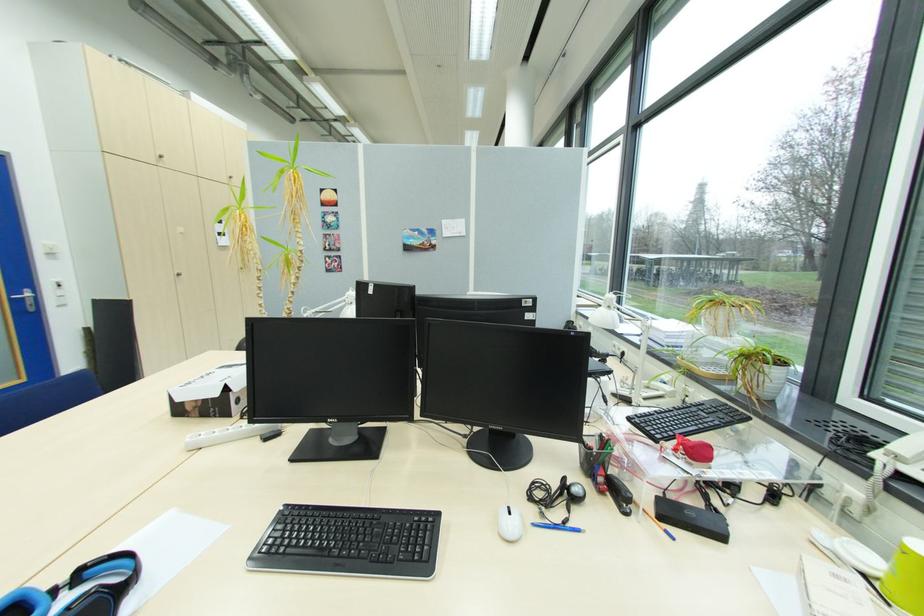
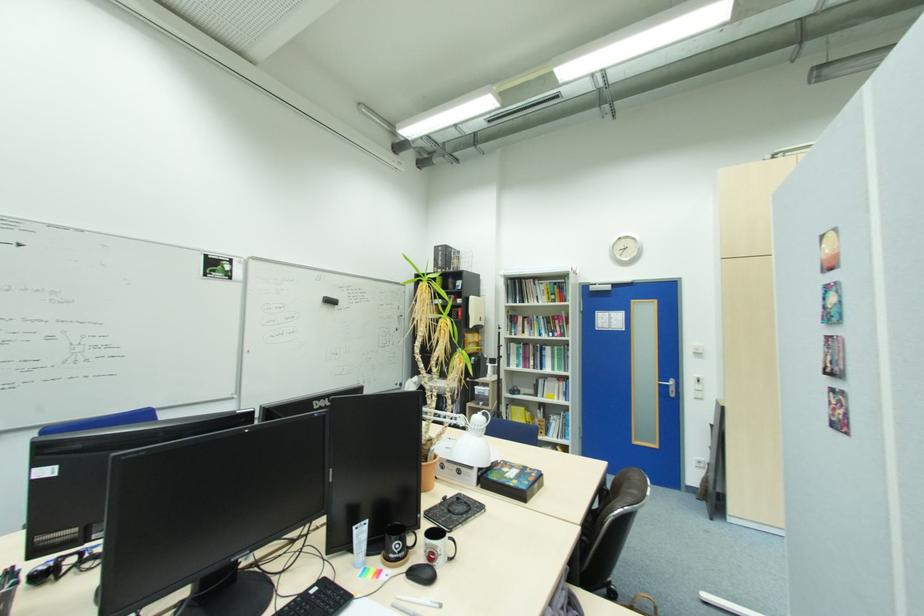
In the second image, find the point that corresponds to point (62, 307) in the first image.

(699, 399)